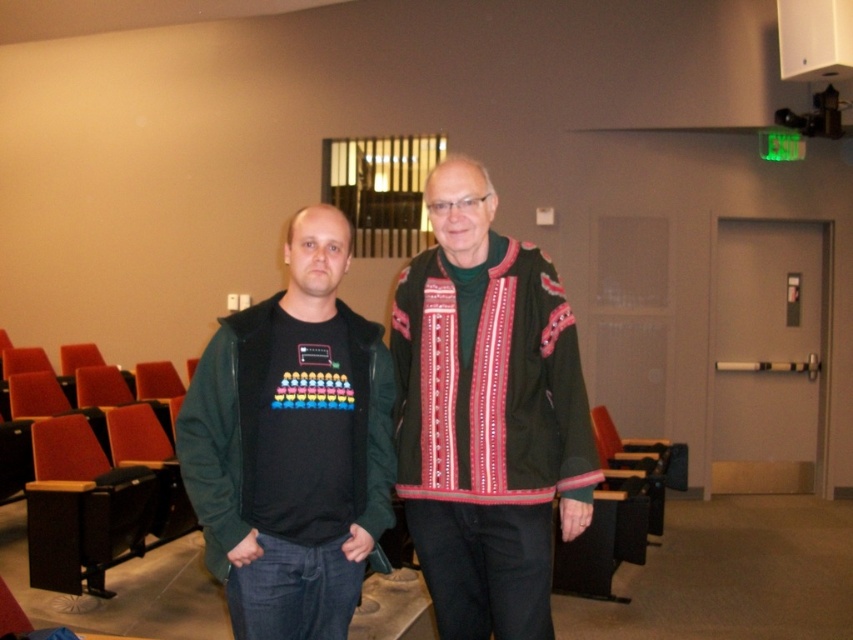
Question: Does dark green woolen sweater at center lie in front of green fleece vest at center?

Choices:
 (A) yes
 (B) no

Answer: (B)

Question: Is the position of dark green textured jacket at center less distant than that of green fleece vest at center?

Choices:
 (A) yes
 (B) no

Answer: (B)

Question: Which point is farther to the camera?

Choices:
 (A) dark green woolen sweater at center
 (B) dark green textured jacket at center
 (C) green fleece vest at center

Answer: (A)

Question: Is dark green woolen sweater at center above green fleece vest at center?

Choices:
 (A) yes
 (B) no

Answer: (A)

Question: Which point appears farthest from the camera in this image?

Choices:
 (A) (555, 360)
 (B) (463, 294)
 (C) (369, 497)

Answer: (B)

Question: Among these objects, which one is farthest from the camera?

Choices:
 (A) green fleece vest at center
 (B) dark green woolen sweater at center

Answer: (B)